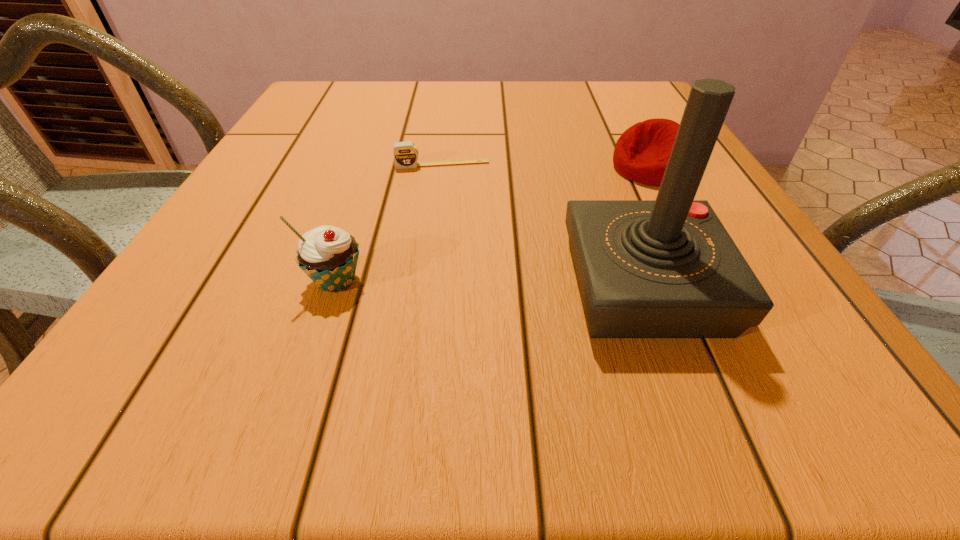
Locate an element on the screen. The height and width of the screenshot is (540, 960). free space located at the front of the shortest object with the tape extended is located at coordinates (464, 318).

The image size is (960, 540). Find the location of `free space located on the seat area of the second shortest object`. free space located on the seat area of the second shortest object is located at coordinates (474, 281).

Locate an element on the screen. This screenshot has height=540, width=960. free region located on the seat area of the second shortest object is located at coordinates (610, 193).

This screenshot has width=960, height=540. Find the location of `vacant space situated 0.120m on the seat area of the second shortest object`. vacant space situated 0.120m on the seat area of the second shortest object is located at coordinates (590, 206).

Where is `cupcake that is at the near edge`? Image resolution: width=960 pixels, height=540 pixels. cupcake that is at the near edge is located at coordinates (328, 255).

The width and height of the screenshot is (960, 540). In order to click on joystick at the near edge in this screenshot , I will do `click(667, 268)`.

Where is `joystick positioned at the right edge`? This screenshot has width=960, height=540. joystick positioned at the right edge is located at coordinates (667, 268).

Identify the location of beanbag at the right edge. The width and height of the screenshot is (960, 540). (641, 154).

You are a GUI agent. You are given a task and a screenshot of the screen. Output one action in this format:
    pyautogui.click(x=<x>, y=<y>)
    Task: Click on the object located in the near right corner section of the desktop
    The height and width of the screenshot is (540, 960).
    Given the screenshot: What is the action you would take?
    pyautogui.click(x=667, y=268)

Identify the location of vacant space at the far edge of the desktop. (454, 83).